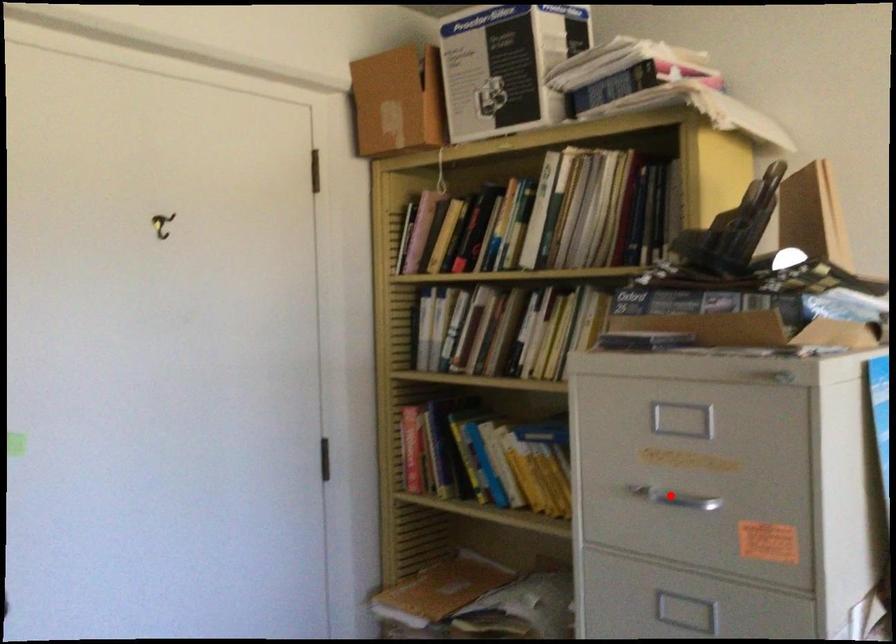
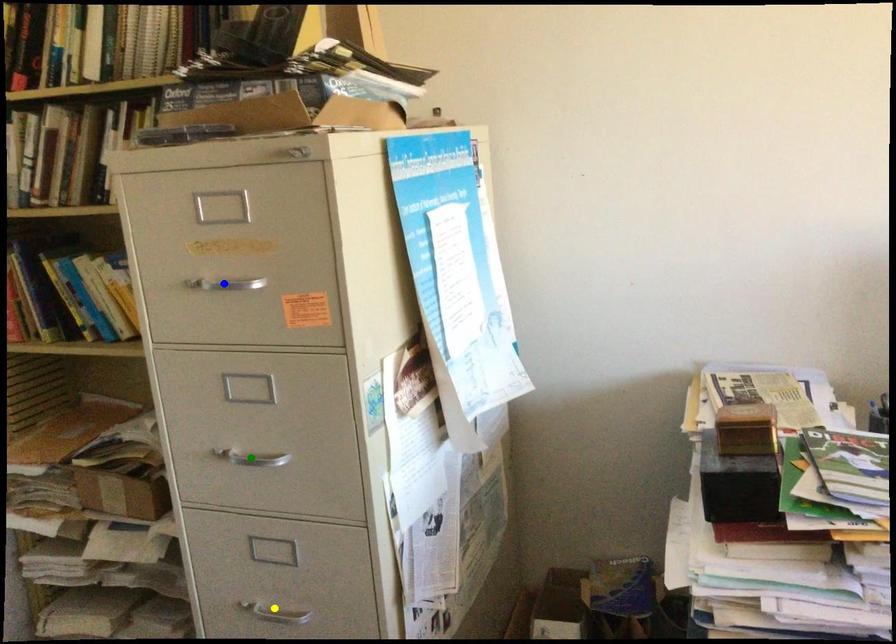
Question: I am providing you with two images of the same scene from different viewpoints. A red point is marked on the first image. You are given multiple points on the second image. Which point in image 2 represents the same 3d spot as the red point in image 1?

Choices:
 (A) yellow point
 (B) blue point
 (C) green point

Answer: (B)